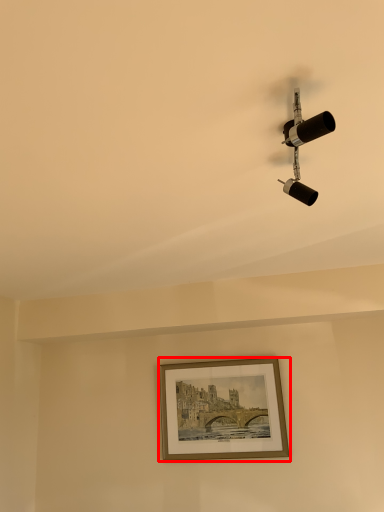
Question: From the image's perspective, where is picture frame (annotated by the red box) located relative to lamp?

Choices:
 (A) below
 (B) above

Answer: (A)